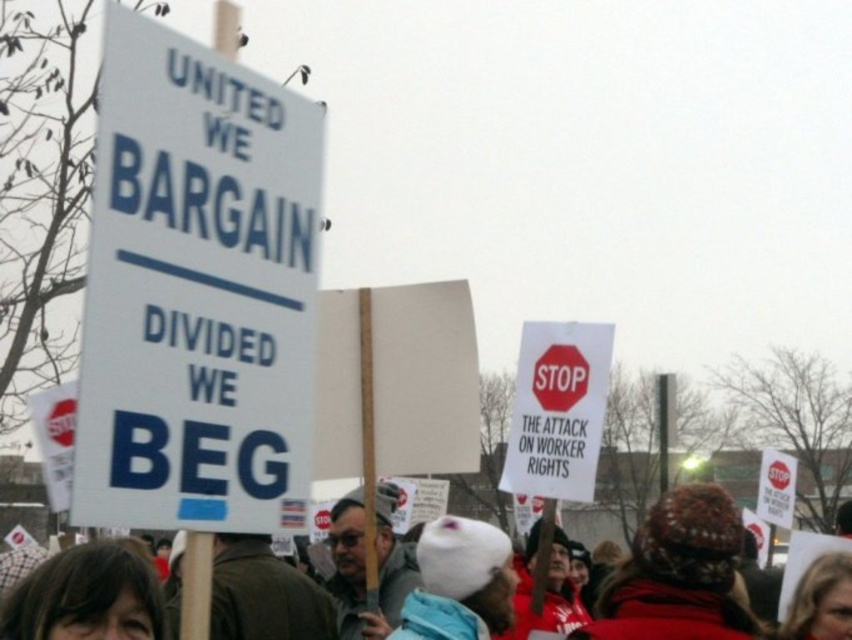
From the picture: Does white paper sign at upper left have a greater width compared to white wool hat at center?

Incorrect, white paper sign at upper left's width does not surpass white wool hat at center's.

This screenshot has height=640, width=852. Describe the element at coordinates (196, 291) in the screenshot. I see `white paper sign at upper left` at that location.

Between point (219, 100) and point (689, 605), which one is positioned behind?

Positioned behind is point (689, 605).

Locate an element on the screen. white paper sign at upper left is located at coordinates (196, 291).

Between white wool hat at center and red matte stop sign at upper center, which one is positioned lower?

white wool hat at center

Is white wool hat at center smaller than red matte stop sign at upper center?

No.

Where is `white wool hat at center`? The image size is (852, 640). white wool hat at center is located at coordinates (676, 573).

Is white paper sign at upper left positioned before red matte stop sign at upper center?

Yes.

Between white paper sign at upper left and red matte stop sign at upper center, which one appears on the right side from the viewer's perspective?

From the viewer's perspective, red matte stop sign at upper center appears more on the right side.

Image resolution: width=852 pixels, height=640 pixels. What are the coordinates of `white paper sign at upper left` in the screenshot? It's located at (196, 291).